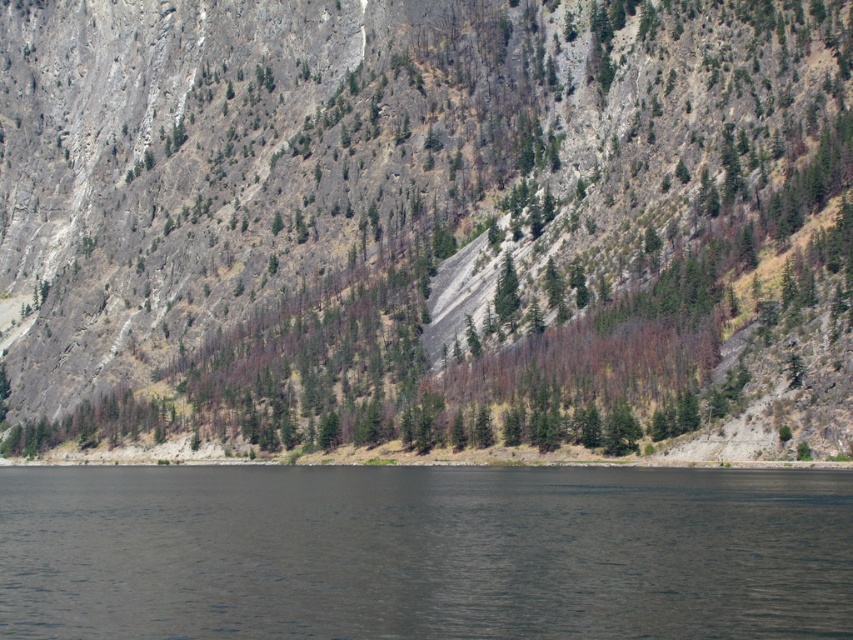
You are a kayaker approaching the dark gray water at lower center. You see the rocky cliff at center ahead. Which direction should you paddle to avoid hitting the cliff?

The rocky cliff at center is positioned over dark gray water at lower center, so you should paddle away from the rocky cliff at center to avoid hitting it.

You are a hiker standing at the edge of the dark gray water at lower center. You want to climb up to the rocky cliff at center. Considering their sizes, which object would require more effort to climb?

The rocky cliff at center has a larger size compared to the dark gray water at lower center, so climbing the rocky cliff at center would require more effort due to its greater size and rugged terrain.

You are a kayaker planning to navigate between the rocky cliff at center and the dark gray water at lower center. Based on their widths, which one do you think will require more space for maneuvering?

The rocky cliff at center has a greater width compared to the dark gray water at lower center, so maneuvering around the rocky cliff at center will require more space.